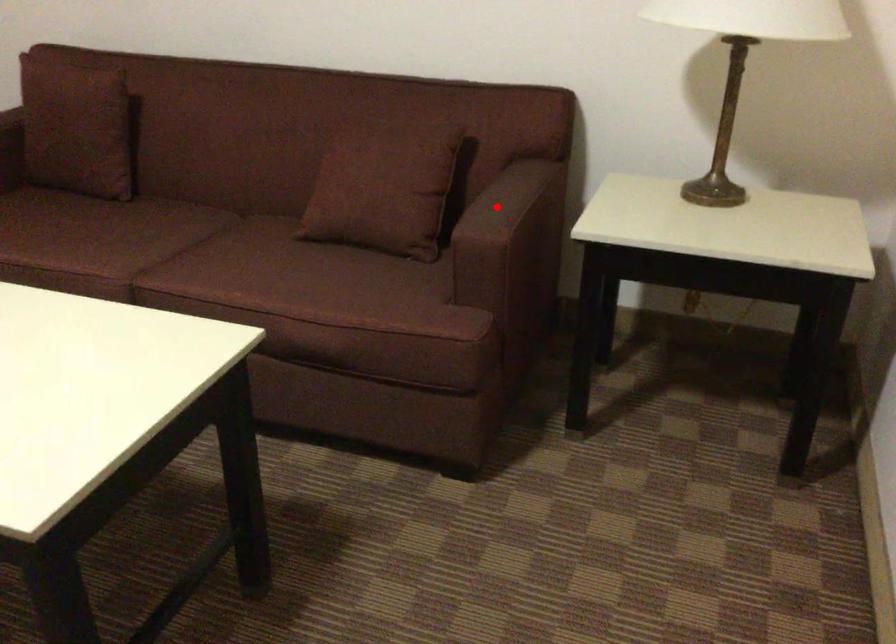
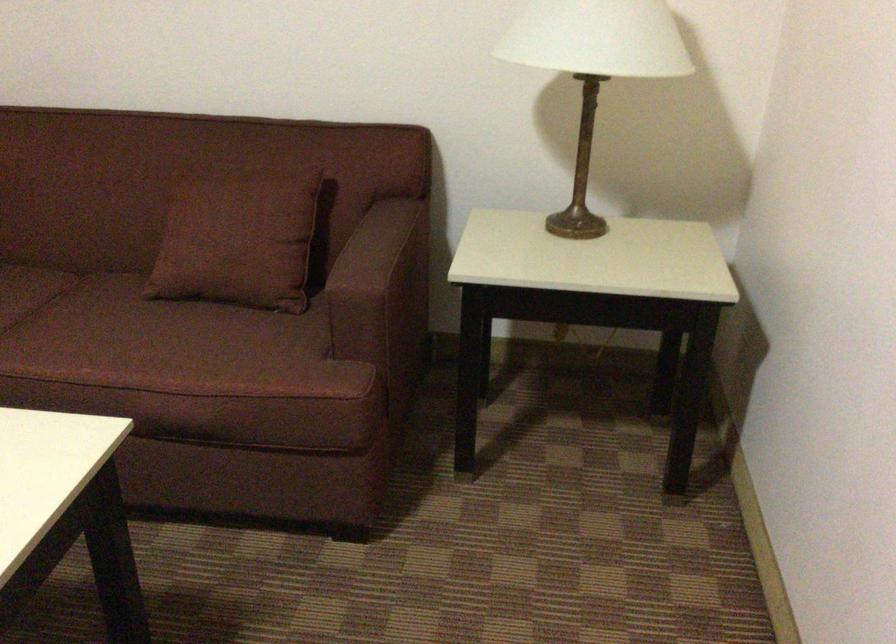
Where in the second image is the point corresponding to the highlighted location from the first image?

(367, 254)